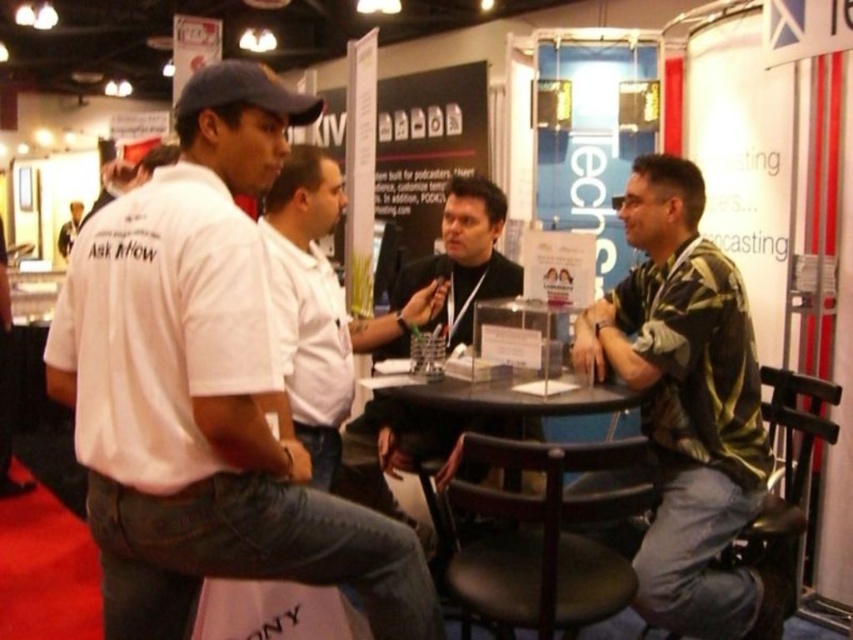
Does green striped shirt at right appear on the left side of black wood table at center?

Incorrect, green striped shirt at right is not on the left side of black wood table at center.

Which is behind, point (700, 289) or point (573, 627)?

The point (700, 289) is more distant.

Does point (682, 394) lie behind point (506, 444)?

Yes.

You are a GUI agent. You are given a task and a screenshot of the screen. Output one action in this format:
    pyautogui.click(x=<x>, y=<y>)
    Task: Click on the green striped shirt at right
    This screenshot has width=853, height=640.
    Given the screenshot: What is the action you would take?
    [686, 408]

Does black wood table at center appear on the right side of black leather jacket at center?

Indeed, black wood table at center is positioned on the right side of black leather jacket at center.

Looking at this image, does black wood table at center appear on the left side of black leather jacket at center?

In fact, black wood table at center is to the right of black leather jacket at center.

Find the location of a particular element. The image size is (853, 640). black wood table at center is located at coordinates (538, 540).

Does green striped shirt at right have a larger size compared to white shirt at left?

Yes.

Who is positioned more to the right, green striped shirt at right or white shirt at left?

green striped shirt at right

Is point (773, 602) farther from viewer compared to point (70, 209)?

No, it is in front of (70, 209).

Find the location of a particular element. green striped shirt at right is located at coordinates (686, 408).